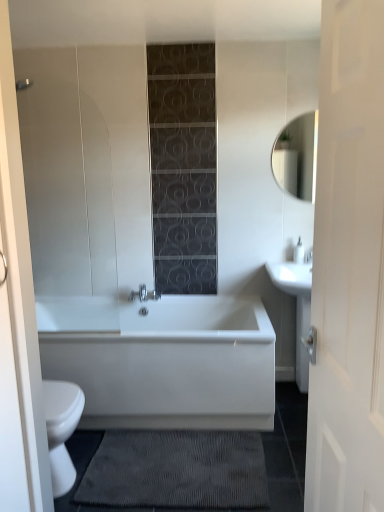
In order to face white glossy sink at right, should I rotate leftwards or rightwards?

You should rotate right by 13.561 degrees.

Describe the element at coordinates (176, 470) in the screenshot. I see `dark gray textured bath mat at lower center` at that location.

This screenshot has height=512, width=384. Describe the element at coordinates (309, 256) in the screenshot. I see `matte silver faucet at upper right` at that location.

You are a GUI agent. You are given a task and a screenshot of the screen. Output one action in this format:
    pyautogui.click(x=<x>, y=<y>)
    Task: Click on the white glossy sink at right
    Image resolution: width=384 pixels, height=512 pixels.
    Given the screenshot: What is the action you would take?
    pyautogui.click(x=298, y=312)

Considering the points (291, 127) and (314, 328), which point is in front, point (291, 127) or point (314, 328)?

The point (314, 328) is closer.

From the image's perspective, is matte white mirror at upper right located above or below white glossy sink at right?

Clearly, from the image's perspective, matte white mirror at upper right is above white glossy sink at right.

Between matte white mirror at upper right and white glossy sink at right, which one has smaller size?

matte white mirror at upper right is smaller.

How different are the orientations of white glossy bathtub at center and matte silver faucet at upper right in degrees?

There is a 0.406-degree angle between the facing directions of white glossy bathtub at center and matte silver faucet at upper right.

Could you tell me if white glossy bathtub at center is facing matte silver faucet at upper right?

No, white glossy bathtub at center is not aimed at matte silver faucet at upper right.

Who is bigger, white glossy bathtub at center or matte silver faucet at upper right?

With larger size is white glossy bathtub at center.

Who is shorter, white glossy bathtub at center or matte silver faucet at upper right?

Standing shorter between the two is matte silver faucet at upper right.

Considering the sizes of objects dark gray textured bath mat at lower center and matte white mirror at upper right in the image provided, who is shorter, dark gray textured bath mat at lower center or matte white mirror at upper right?

With less height is dark gray textured bath mat at lower center.

Looking at this image, from the image's perspective, relative to matte white mirror at upper right, is dark gray textured bath mat at lower center above or below?

dark gray textured bath mat at lower center is below matte white mirror at upper right.

Looking at this image, would you say dark gray textured bath mat at lower center is inside or outside matte white mirror at upper right?

dark gray textured bath mat at lower center is located beyond the bounds of matte white mirror at upper right.

Which is in front, dark gray textured bath mat at lower center or matte white mirror at upper right?

dark gray textured bath mat at lower center.

How far apart are white wood door at right and dark gray textured bath mat at lower center?

The distance of white wood door at right from dark gray textured bath mat at lower center is 1.21 meters.

Is white wood door at right looking in the opposite direction of dark gray textured bath mat at lower center?

No, dark gray textured bath mat at lower center is not at the back of white wood door at right.

Is point (351, 4) closer or farther from the camera than point (265, 490)?

Point (351, 4).

Would you say white wood door at right contains dark gray textured bath mat at lower center?

Actually, dark gray textured bath mat at lower center is outside white wood door at right.

Considering the relative sizes of white wood door at right and matte white mirror at upper right in the image provided, is white wood door at right smaller than matte white mirror at upper right?

Actually, white wood door at right might be larger than matte white mirror at upper right.

Based on the photo, is white wood door at right at the left side of matte white mirror at upper right?

Indeed, white wood door at right is positioned on the left side of matte white mirror at upper right.

Is white wood door at right in front of matte white mirror at upper right?

That is True.

From the image's perspective, between white wood door at right and matte white mirror at upper right, which one is located above?

From the image's view, matte white mirror at upper right is above.

In the scene shown: From the image's perspective, is dark gray textured bath mat at lower center beneath matte silver faucet at upper right?

Correct, dark gray textured bath mat at lower center appears lower than matte silver faucet at upper right in the image.

Between dark gray textured bath mat at lower center and matte silver faucet at upper right, which one has larger size?

dark gray textured bath mat at lower center.

Can matte silver faucet at upper right be found inside dark gray textured bath mat at lower center?

Actually, matte silver faucet at upper right is outside dark gray textured bath mat at lower center.

Does point (212, 476) come in front of point (309, 256)?

Yes, it is in front of point (309, 256).

Between white glossy bathtub at center and matte white mirror at upper right, which one appears on the right side from the viewer's perspective?

matte white mirror at upper right.

In terms of width, does white glossy bathtub at center look wider or thinner when compared to matte white mirror at upper right?

Clearly, white glossy bathtub at center has more width compared to matte white mirror at upper right.

In the scene shown: From the image's perspective, which one is positioned higher, white glossy bathtub at center or matte white mirror at upper right?

matte white mirror at upper right.

What are the coordinates of `mirror above the white glossy sink at right (from a real-world perspective)` in the screenshot? It's located at (297, 157).

Locate an element on the screen. faucet behind the white glossy bathtub at center is located at coordinates (x=309, y=256).

Looking at the image, which one is located closer to matte silver faucet at upper right, dark gray textured bath mat at lower center or matte white mirror at upper right?

The object closer to matte silver faucet at upper right is matte white mirror at upper right.

When comparing their distances from white wood door at right, does matte silver faucet at upper right or dark gray textured bath mat at lower center seem closer?

dark gray textured bath mat at lower center is positioned closer to the anchor white wood door at right.

Which object lies nearer to the anchor point white wood door at right, white glossy sink at right or matte silver faucet at upper right?

The object closer to white wood door at right is matte silver faucet at upper right.

Considering their positions, is dark gray textured bath mat at lower center positioned further to white glossy sink at right than matte white mirror at upper right?

dark gray textured bath mat at lower center.

Considering their positions, is white glossy bathtub at center positioned closer to dark gray textured bath mat at lower center than white wood door at right?

Based on the image, white glossy bathtub at center appears to be nearer to dark gray textured bath mat at lower center.

From the image, which object appears to be nearer to white glossy bathtub at center, matte silver faucet at upper right or white glossy sink at right?

Among the two, white glossy sink at right is located nearer to white glossy bathtub at center.

Which object lies nearer to the anchor point matte silver faucet at upper right, white glossy bathtub at center or matte white mirror at upper right?

matte white mirror at upper right is positioned closer to the anchor matte silver faucet at upper right.

Estimate the real-world distances between objects in this image. Which object is closer to matte white mirror at upper right, dark gray textured bath mat at lower center or white glossy sink at right?

Based on the image, white glossy sink at right appears to be nearer to matte white mirror at upper right.

You are a GUI agent. You are given a task and a screenshot of the screen. Output one action in this format:
    pyautogui.click(x=<x>, y=<y>)
    Task: Click on the bathtub between matte white mirror at upper right and dark gray textured bath mat at lower center in the vertical direction
    Image resolution: width=384 pixels, height=512 pixels.
    Given the screenshot: What is the action you would take?
    pyautogui.click(x=173, y=365)

Where is `bath mat between white wood door at right and white glossy sink at right from front to back`? bath mat between white wood door at right and white glossy sink at right from front to back is located at coordinates point(176,470).

Locate an element on the screen. This screenshot has width=384, height=512. faucet that lies between matte white mirror at upper right and white glossy bathtub at center from top to bottom is located at coordinates (309, 256).

Locate an element on the screen. Image resolution: width=384 pixels, height=512 pixels. sink between white glossy bathtub at center and matte silver faucet at upper right is located at coordinates (298, 312).